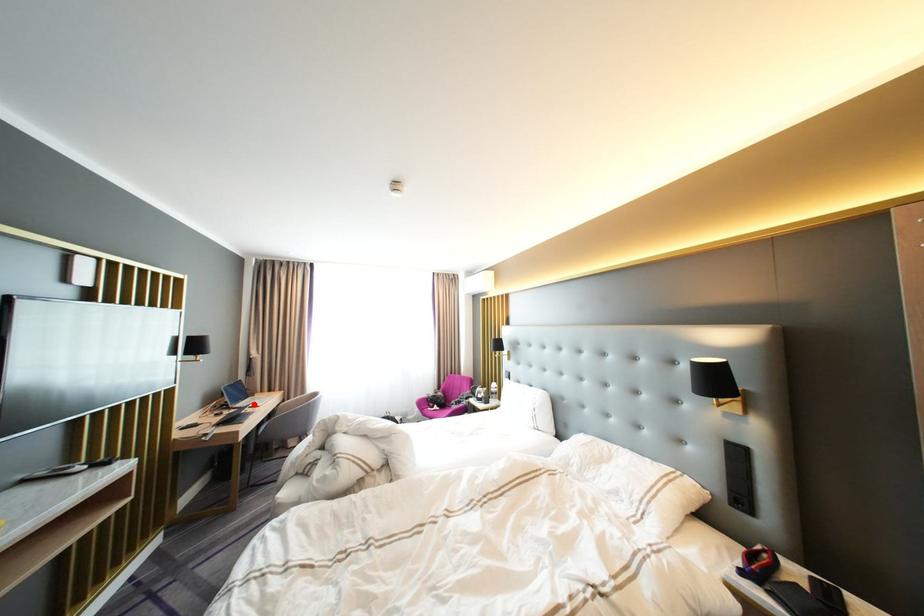
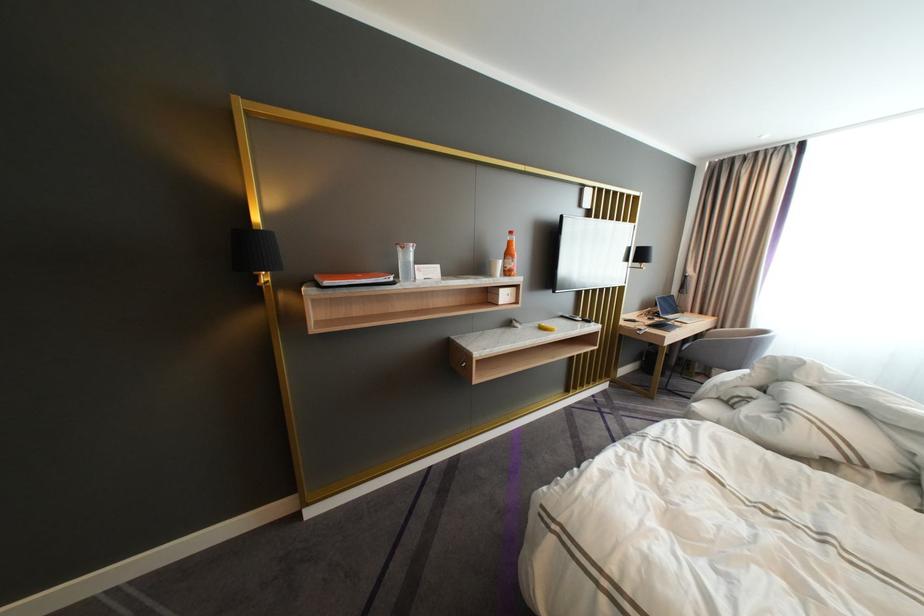
Locate, in the second image, the point that corresponds to the highlighted location in the first image.

(683, 317)